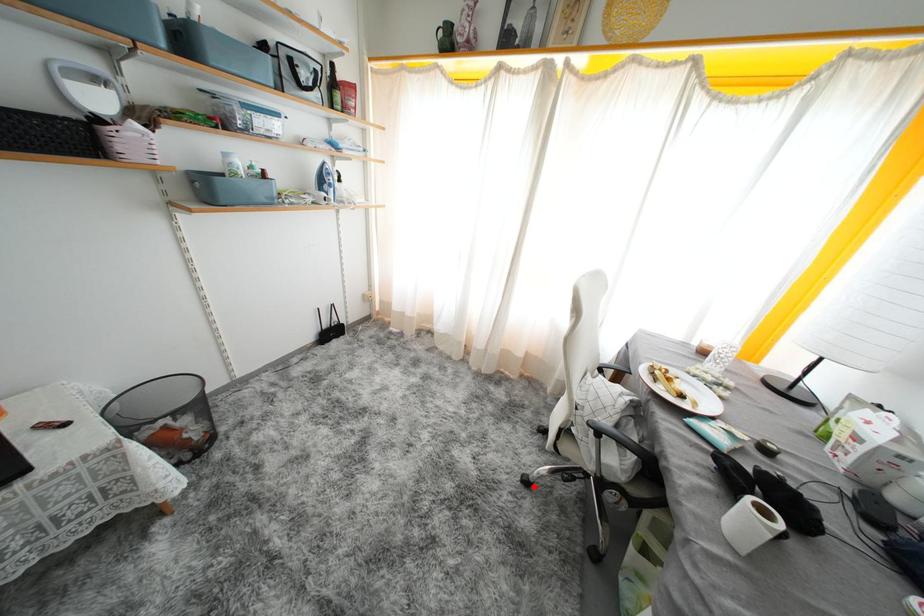
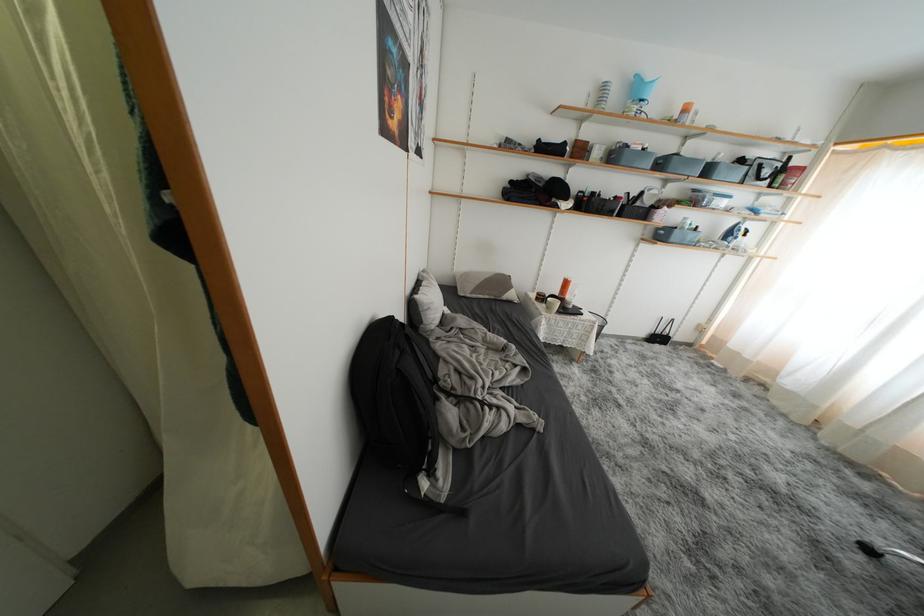
In the second image, find the point that corresponds to the highlighted location in the first image.

(876, 554)